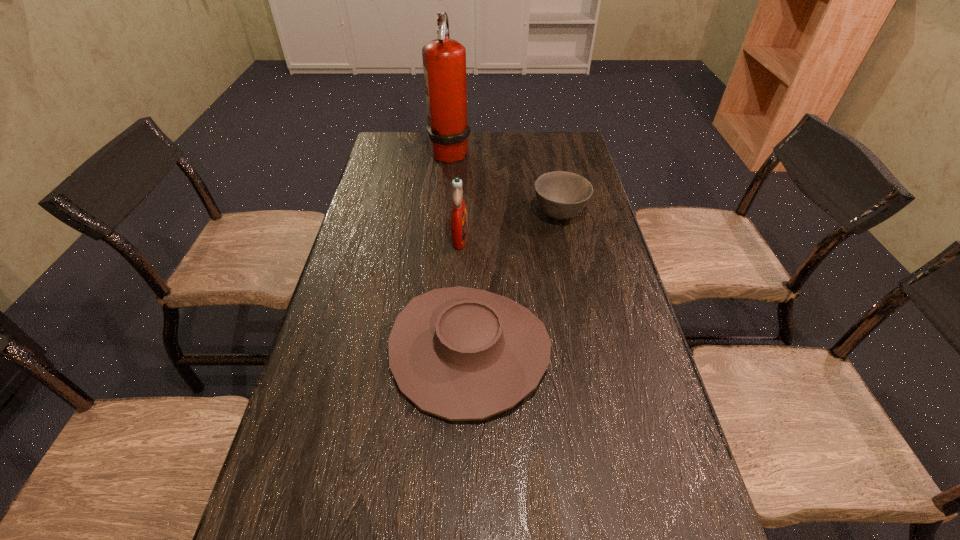
What are the coordinates of `object present at the right edge` in the screenshot? It's located at (561, 195).

Locate an element on the screen. This screenshot has height=540, width=960. blank space at the far edge of the desktop is located at coordinates (524, 137).

This screenshot has height=540, width=960. Find the location of `vacant space at the left edge of the desktop`. vacant space at the left edge of the desktop is located at coordinates tap(372, 252).

The width and height of the screenshot is (960, 540). In the image, there is a desktop. What are the coordinates of `free space at the right edge` in the screenshot? It's located at (609, 298).

In the image, there is a desktop. Identify the location of vacant space at the far left corner. (414, 160).

I want to click on vacant area at the far right corner, so click(561, 139).

Locate an element on the screen. The height and width of the screenshot is (540, 960). unoccupied position between the farthest object and the nearest object is located at coordinates (460, 251).

The width and height of the screenshot is (960, 540). In order to click on free spot between the third shortest object and the bowl in this screenshot , I will do `click(510, 226)`.

At what (x,y) coordinates should I click in order to perform the action: click on vacant area between the cowboy hat and the bowl. Please return your answer as a coordinate pair (x, y). Looking at the image, I should click on [x=515, y=282].

Find the location of a particular element. free space that is in between the tallest object and the nearest object is located at coordinates (460, 251).